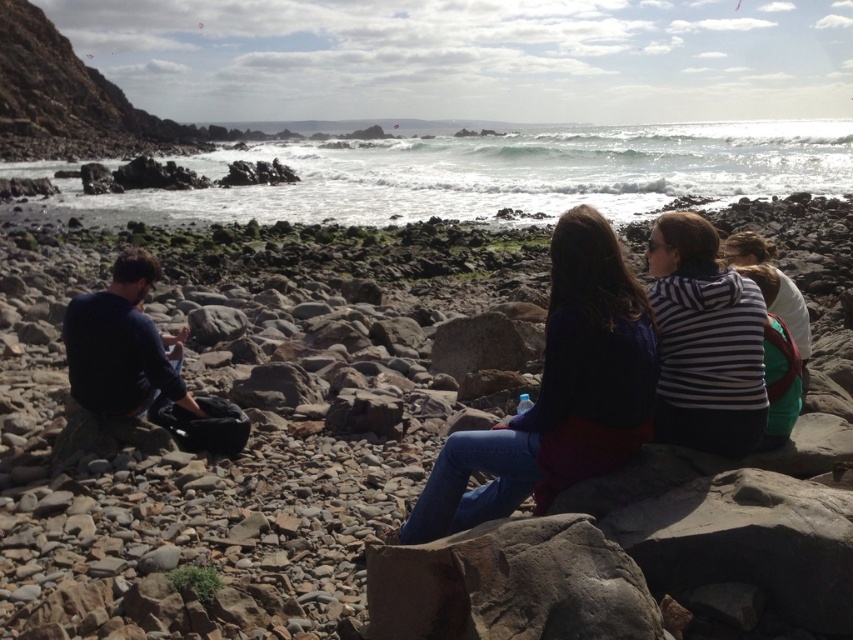
Question: Can you confirm if white frothy water at center is wider than striped fabric hoodie at center right?

Choices:
 (A) no
 (B) yes

Answer: (B)

Question: Can you confirm if striped fabric hoodie at center right is bigger than striped fabric hoodie at right?

Choices:
 (A) no
 (B) yes

Answer: (B)

Question: Which point is farther to the camera?

Choices:
 (A) white frothy water at center
 (B) dark blue sweater at center

Answer: (A)

Question: Does white frothy water at center have a larger size compared to dark blue sweater at left?

Choices:
 (A) yes
 (B) no

Answer: (A)

Question: Among these objects, which one is nearest to the camera?

Choices:
 (A) striped fabric hoodie at center right
 (B) dark blue sweater at center
 (C) white frothy water at center

Answer: (B)

Question: Which object is the farthest from the striped fabric hoodie at center right?

Choices:
 (A) striped fabric hoodie at right
 (B) dark blue sweater at left
 (C) white frothy water at center

Answer: (C)